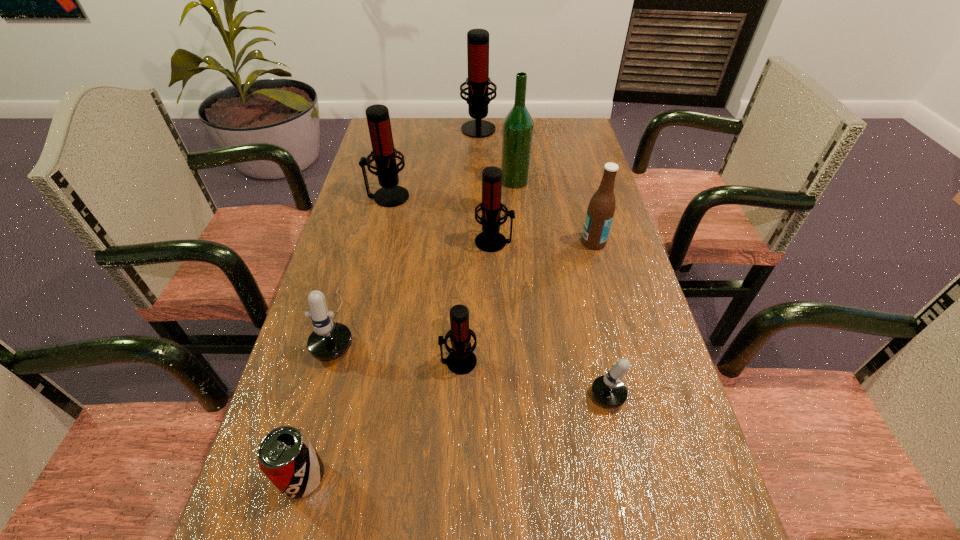
Locate an element on the screen. the fifth closest microphone to the soda can is located at coordinates (384, 154).

Image resolution: width=960 pixels, height=540 pixels. I want to click on the third closest red microphone to the green alcohol, so point(384,154).

Locate which red microphone ranks second in proximity to the farthest object. Please provide its 2D coordinates. Your answer should be formatted as a tuple, i.e. [(x, y)], where the tuple contains the x and y coordinates of a point satisfying the conditions above.

[(490, 240)]

At what (x,y) coordinates should I click in order to perform the action: click on free location that satisfies the following two spatial constraints: 1. on the back side of the biggest red microphone; 2. on the left side of the left white microphone. Please return your answer as a coordinate pair (x, y). This screenshot has height=540, width=960. Looking at the image, I should click on (395, 127).

Image resolution: width=960 pixels, height=540 pixels. In order to click on free space in the image that satisfies the following two spatial constraints: 1. on the front side of the farther white microphone; 2. on the right side of the right white microphone in this screenshot , I will do `click(320, 397)`.

You are a GUI agent. You are given a task and a screenshot of the screen. Output one action in this format:
    pyautogui.click(x=<x>, y=<y>)
    Task: Click on the vacant space that satisfies the following two spatial constraints: 1. on the front side of the biggest red microphone; 2. on the left side of the beer bottle
    The image size is (960, 540).
    Given the screenshot: What is the action you would take?
    (x=478, y=242)